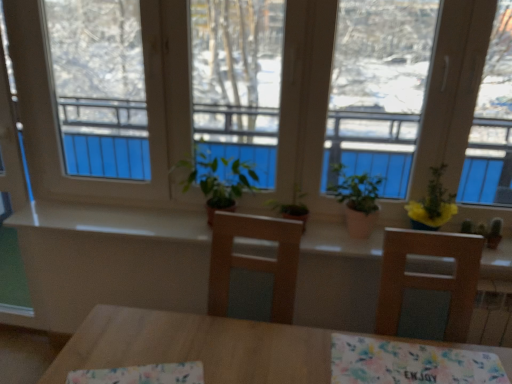
Question: Considering the positions of point (507, 273) and point (431, 198), is point (507, 273) closer or farther from the camera than point (431, 198)?

Choices:
 (A) farther
 (B) closer

Answer: (B)

Question: Which is correct: white glossy counter top at center is inside yellow matte plant at upper right, which is the third houseplant in left-to-right order, or outside of it?

Choices:
 (A) outside
 (B) inside

Answer: (A)

Question: Which of these objects is positioned farthest from the floral fabric at center, which appears as the first tablecloth when viewed from the left?

Choices:
 (A) yellow matte plant at upper right, which is the third houseplant in left-to-right order
 (B) green matte plant at center, marked as the first houseplant in a left-to-right arrangement
 (C) floral fabric tablecloth at lower center, which is the 1th tablecloth in right-to-left order
 (D) white glossy counter top at center
 (E) green matte plant at center, the second houseplant viewed from the right

Answer: (A)

Question: Based on their relative distances, which object is farther from the white glossy counter top at center?

Choices:
 (A) floral fabric tablecloth at lower center, positioned as the 2th tablecloth in left-to-right order
 (B) green matte plant at center, the 2th houseplant from the left
 (C) floral fabric at center, the second tablecloth from the right
 (D) yellow matte plant at upper right, acting as the 1th houseplant starting from the right
 (E) transparent glass window at center

Answer: (D)